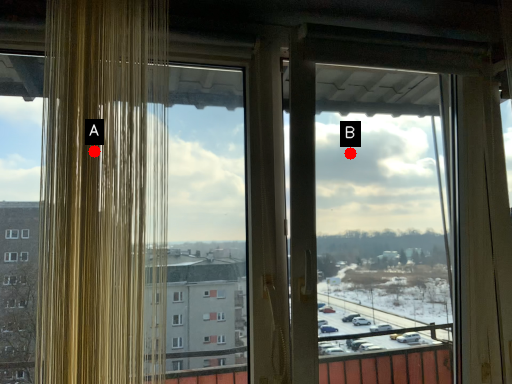
Question: Two points are circled on the image, labeled by A and B beside each circle. Which point is closer to the camera?

Choices:
 (A) A is closer
 (B) B is closer

Answer: (A)